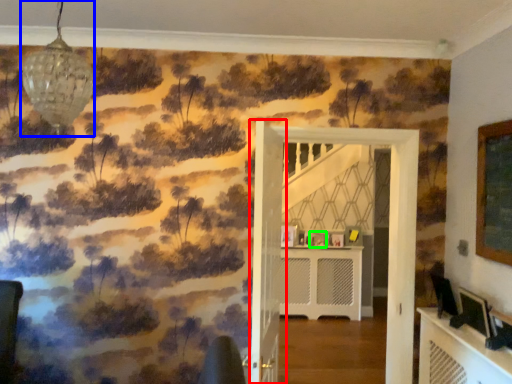
Question: Estimate the real-world distances between objects in this image. Which object is closer to door (highlighted by a red box), light fixture (highlighted by a blue box) or picture frame (highlighted by a green box)?

Choices:
 (A) light fixture
 (B) picture frame

Answer: (A)